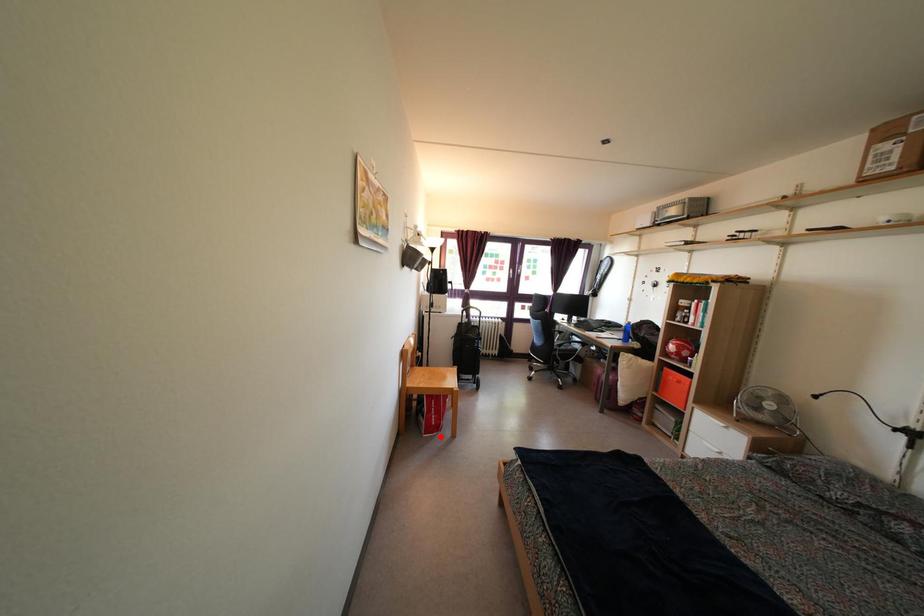
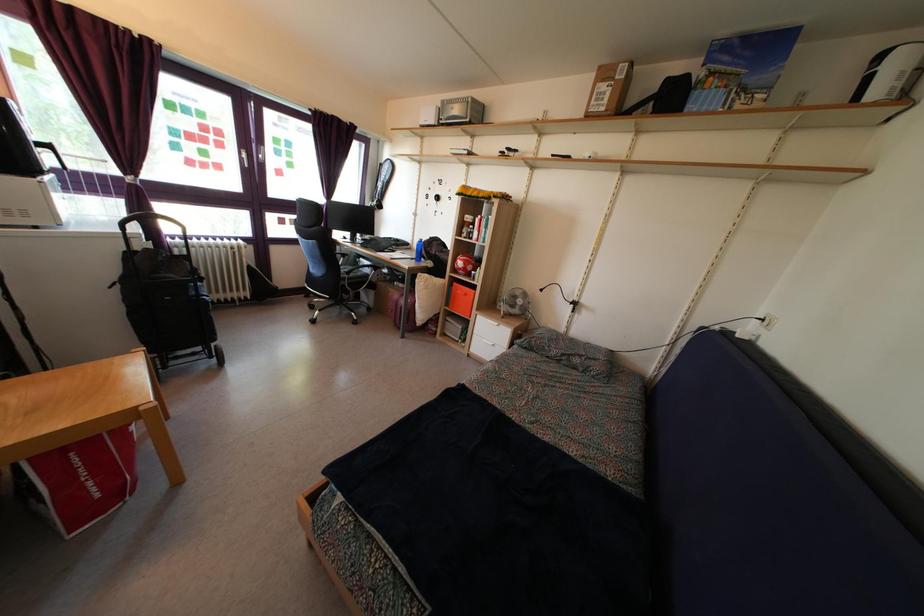
Where in the second image is the point corresponding to the highlighted location from the first image?

(122, 501)